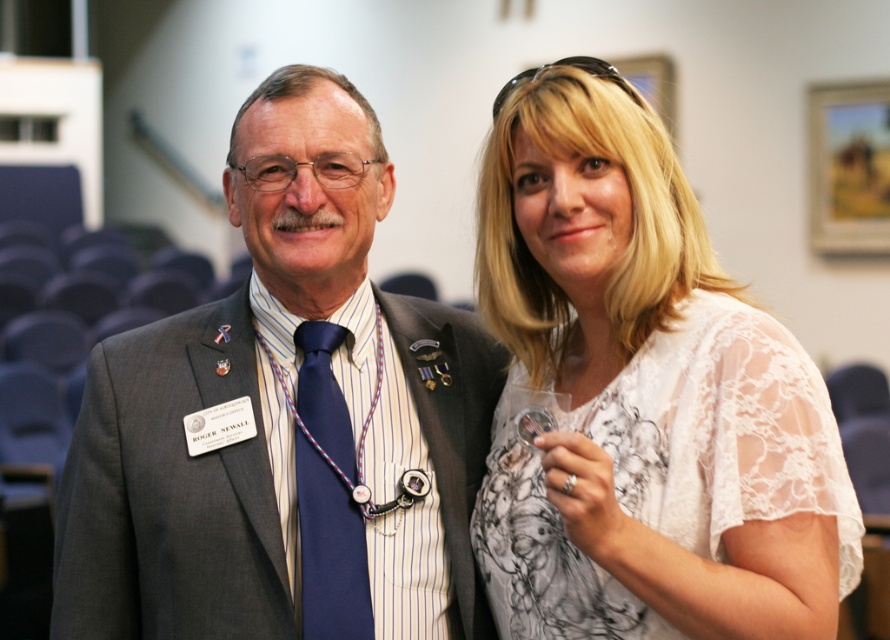
Who is shorter, white lace blouse at upper right or navy blue silk tie at center?

navy blue silk tie at center is shorter.

Who is more forward, (527, 388) or (345, 528)?

Point (345, 528) is in front.

Where is `white lace blouse at upper right`? Image resolution: width=890 pixels, height=640 pixels. white lace blouse at upper right is located at coordinates click(x=641, y=396).

Can you confirm if gray suit at center is thinner than white lace blouse at upper right?

In fact, gray suit at center might be wider than white lace blouse at upper right.

Does gray suit at center have a greater height compared to white lace blouse at upper right?

Yes.

Image resolution: width=890 pixels, height=640 pixels. What do you see at coordinates (282, 419) in the screenshot?
I see `gray suit at center` at bounding box center [282, 419].

This screenshot has width=890, height=640. In order to click on gray suit at center in this screenshot , I will do click(282, 419).

Can you confirm if gray suit at center is positioned to the left of navy blue silk tie at center?

Correct, you'll find gray suit at center to the left of navy blue silk tie at center.

Does gray suit at center appear on the right side of navy blue silk tie at center?

In fact, gray suit at center is to the left of navy blue silk tie at center.

Which is in front, point (282, 573) or point (333, 401)?

Positioned in front is point (282, 573).

Locate an element on the screen. gray suit at center is located at coordinates (282, 419).